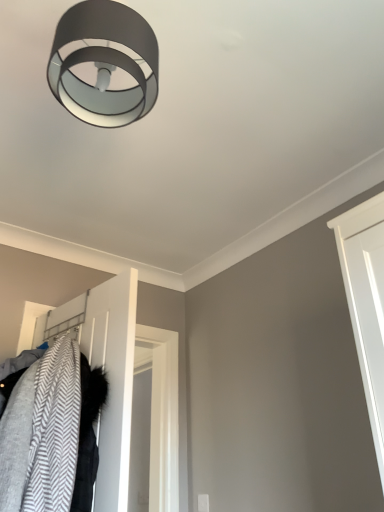
I want to click on matte gray ring light at upper center, so click(104, 63).

What do you see at coordinates (104, 63) in the screenshot? I see `matte gray ring light at upper center` at bounding box center [104, 63].

At what (x,y) coordinates should I click in order to perform the action: click on white matte door at lower left. Please return your answer as a coordinate pair (x, y). Looking at the image, I should click on (112, 381).

Measure the distance between point (113, 312) and camera.

Point (113, 312) is 5.65 feet away from camera.

What do you see at coordinates (112, 381) in the screenshot? Image resolution: width=384 pixels, height=512 pixels. I see `white matte door at lower left` at bounding box center [112, 381].

Identify the location of matte gray ring light at upper center. The width and height of the screenshot is (384, 512). (104, 63).

Is matte gray ring light at upper center to the left of white matte door at lower left from the viewer's perspective?

In fact, matte gray ring light at upper center is to the right of white matte door at lower left.

Considering their positions, is matte gray ring light at upper center located in front of or behind white matte door at lower left?

Visually, matte gray ring light at upper center is located in front of white matte door at lower left.

Is point (108, 96) closer or farther from the camera than point (87, 347)?

Point (108, 96) appears to be closer to the viewer than point (87, 347).

From the image's perspective, which one is positioned higher, matte gray ring light at upper center or white matte door at lower left?

matte gray ring light at upper center.

From a real-world perspective, which object rests below the other?

white matte door at lower left.

Looking at their sizes, would you say matte gray ring light at upper center is wider or thinner than white matte door at lower left?

matte gray ring light at upper center is wider than white matte door at lower left.

Is matte gray ring light at upper center taller or shorter than white matte door at lower left?

matte gray ring light at upper center is shorter than white matte door at lower left.

Does matte gray ring light at upper center have a smaller size compared to white matte door at lower left?

Indeed, matte gray ring light at upper center has a smaller size compared to white matte door at lower left.

Is matte gray ring light at upper center inside or outside of white matte door at lower left?

matte gray ring light at upper center is spatially situated outside white matte door at lower left.

Is there a large distance between matte gray ring light at upper center and white matte door at lower left?

matte gray ring light at upper center is near white matte door at lower left, not far away.

Does matte gray ring light at upper center turn towards white matte door at lower left?

No, matte gray ring light at upper center is not turned towards white matte door at lower left.

How many degrees apart are the facing directions of matte gray ring light at upper center and white matte door at lower left?

There is a 80.4-degree angle between the facing directions of matte gray ring light at upper center and white matte door at lower left.

Where is `door on the left of matte gray ring light at upper center`? door on the left of matte gray ring light at upper center is located at coordinates (112, 381).

Based on the photo, between white matte door at lower left and matte gray ring light at upper center, which one appears on the left side from the viewer's perspective?

Positioned to the left is white matte door at lower left.

Considering the relative positions of white matte door at lower left and matte gray ring light at upper center in the image provided, is white matte door at lower left in front of matte gray ring light at upper center?

No, white matte door at lower left is further to the viewer.

Does point (95, 300) appear closer or farther from the camera than point (71, 111)?

Point (95, 300) is farther from the camera than point (71, 111).

From the image's perspective, is white matte door at lower left beneath matte gray ring light at upper center?

Indeed, from the image's perspective, white matte door at lower left is shown beneath matte gray ring light at upper center.

From a real-world perspective, is white matte door at lower left physically located above or below matte gray ring light at upper center?

From a real-world perspective, white matte door at lower left is physically below matte gray ring light at upper center.

Which object is wider, white matte door at lower left or matte gray ring light at upper center?

With larger width is matte gray ring light at upper center.

Between white matte door at lower left and matte gray ring light at upper center, which one has more height?

white matte door at lower left is taller.

Considering the sizes of objects white matte door at lower left and matte gray ring light at upper center in the image provided, who is smaller, white matte door at lower left or matte gray ring light at upper center?

Smaller between the two is matte gray ring light at upper center.

Do you think white matte door at lower left is within matte gray ring light at upper center, or outside of it?

white matte door at lower left exists outside the volume of matte gray ring light at upper center.

Are white matte door at lower left and matte gray ring light at upper center beside each other?

No, white matte door at lower left is not touching matte gray ring light at upper center.

Is white matte door at lower left facing away from matte gray ring light at upper center?

No, white matte door at lower left is not facing away from matte gray ring light at upper center.

How different are the orientations of white matte door at lower left and matte gray ring light at upper center in degrees?

They differ by 80.4 degrees in their facing directions.

How much distance is there between white matte door at lower left and matte gray ring light at upper center?

white matte door at lower left is 34.32 inches from matte gray ring light at upper center.

The height and width of the screenshot is (512, 384). Find the location of `door below the matte gray ring light at upper center (from a real-world perspective)`. door below the matte gray ring light at upper center (from a real-world perspective) is located at coordinates (112, 381).

Locate an element on the screen. door below the matte gray ring light at upper center (from a real-world perspective) is located at coordinates (112, 381).

You are a GUI agent. You are given a task and a screenshot of the screen. Output one action in this format:
    pyautogui.click(x=<x>, y=<y>)
    Task: Click on the lamp in front of the white matte door at lower left
    
    Given the screenshot: What is the action you would take?
    pyautogui.click(x=104, y=63)